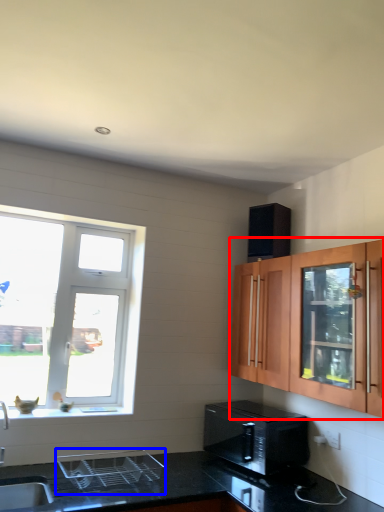
Question: Which of the following is the farthest to the observer, cabinetry (highlighted by a red box) or appliance (highlighted by a blue box)?

Choices:
 (A) cabinetry
 (B) appliance

Answer: (B)